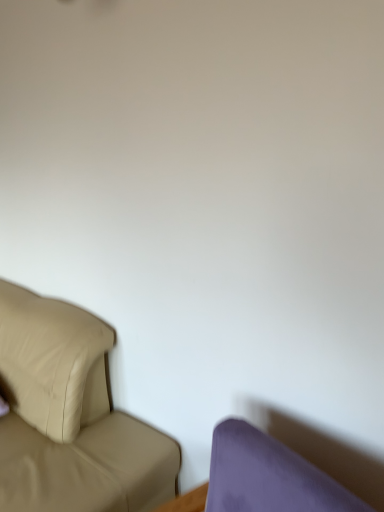
The width and height of the screenshot is (384, 512). I want to click on tan leather couch at left, so click(70, 416).

This screenshot has height=512, width=384. What do you see at coordinates (70, 416) in the screenshot? I see `tan leather couch at left` at bounding box center [70, 416].

This screenshot has width=384, height=512. What are the coordinates of `tan leather couch at left` in the screenshot? It's located at (70, 416).